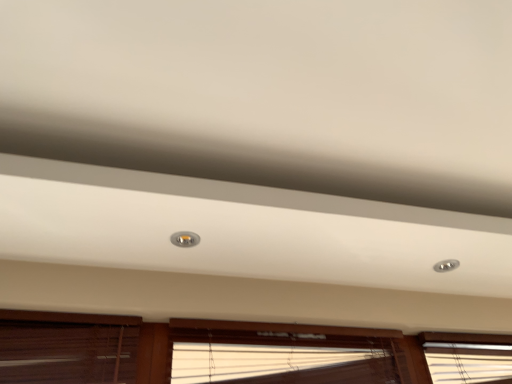
Question: Is the position of translucent bamboo blinds at lower center, acting as the second window starting from the right, more distant than that of wooden blinds at lower center, placed as the 3th window when sorted from left to right?

Choices:
 (A) yes
 (B) no

Answer: (A)

Question: Could you tell me if translucent bamboo blinds at lower center, acting as the second window starting from the right, is turned towards wooden blinds at lower center, placed as the 3th window when sorted from left to right?

Choices:
 (A) yes
 (B) no

Answer: (A)

Question: From the image's perspective, does translucent bamboo blinds at lower center, acting as the second window starting from the right, appear higher than wooden blinds at lower center, which is the first window from right to left?

Choices:
 (A) yes
 (B) no

Answer: (B)

Question: From a real-world perspective, does translucent bamboo blinds at lower center, the 2th window positioned from the left, sit lower than wooden blinds at lower center, placed as the 3th window when sorted from left to right?

Choices:
 (A) yes
 (B) no

Answer: (A)

Question: Would you say translucent bamboo blinds at lower center, acting as the second window starting from the right, contains wooden blinds at lower center, placed as the 3th window when sorted from left to right?

Choices:
 (A) yes
 (B) no

Answer: (B)

Question: From a real-world perspective, is translucent bamboo blinds at lower center, the 2th window positioned from the left, located higher than wooden blinds at lower center, which is the first window from right to left?

Choices:
 (A) yes
 (B) no

Answer: (B)

Question: Is matte silver droplight at center not within translucent bamboo blinds at lower center, acting as the second window starting from the right?

Choices:
 (A) yes
 (B) no

Answer: (A)

Question: From a real-world perspective, is matte silver droplight at center positioned over translucent bamboo blinds at lower center, acting as the second window starting from the right, based on gravity?

Choices:
 (A) yes
 (B) no

Answer: (A)

Question: Considering the relative sizes of matte silver droplight at center and translucent bamboo blinds at lower center, the 2th window positioned from the left, in the image provided, is matte silver droplight at center smaller than translucent bamboo blinds at lower center, the 2th window positioned from the left,?

Choices:
 (A) no
 (B) yes

Answer: (B)

Question: Is matte silver droplight at center bigger than translucent bamboo blinds at lower center, the 2th window positioned from the left?

Choices:
 (A) yes
 (B) no

Answer: (B)

Question: From the image's perspective, is matte silver droplight at center under translucent bamboo blinds at lower center, the 2th window positioned from the left?

Choices:
 (A) yes
 (B) no

Answer: (B)

Question: Does matte silver droplight at center appear on the left side of translucent bamboo blinds at lower center, acting as the second window starting from the right?

Choices:
 (A) no
 (B) yes

Answer: (B)

Question: Is translucent bamboo blinds at lower center, the 2th window positioned from the left, completely or partially outside of brown wood blinds at lower left, placed as the 1th window when sorted from left to right?

Choices:
 (A) no
 (B) yes

Answer: (B)